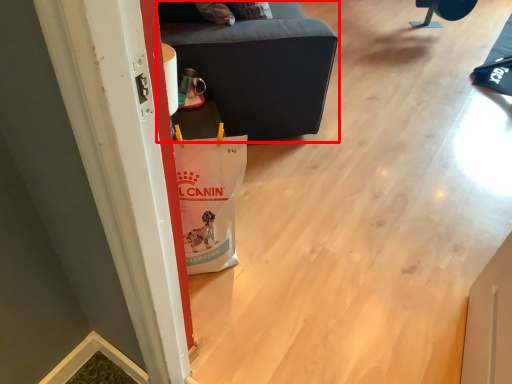
Question: Considering the relative positions of furniture (annotated by the red box) and furniture in the image provided, where is furniture (annotated by the red box) located with respect to the staircase?

Choices:
 (A) left
 (B) right

Answer: (A)